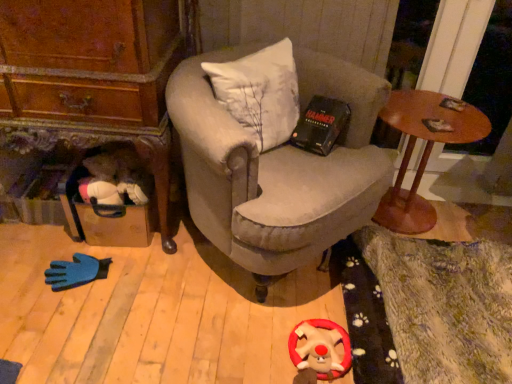
The width and height of the screenshot is (512, 384). In order to click on wooden round table at right in this screenshot , I will do `click(423, 153)`.

Identify the location of velvet gray armchair at center. (278, 166).

From the image's perspective, which one is positioned lower, velvety red plush reindeer at lower center or velvet gray armchair at center?

velvety red plush reindeer at lower center, from the image's perspective.

Which object is positioned more to the left, velvety red plush reindeer at lower center or velvet gray armchair at center?

From the viewer's perspective, velvet gray armchair at center appears more on the left side.

Can you confirm if velvety red plush reindeer at lower center is thinner than velvet gray armchair at center?

Correct, the width of velvety red plush reindeer at lower center is less than that of velvet gray armchair at center.

How different are the orientations of velvety red plush reindeer at lower center and velvet gray armchair at center in degrees?

The angle between the facing direction of velvety red plush reindeer at lower center and the facing direction of velvet gray armchair at center is 44.2 degrees.

Can you tell me how much wooden round table at right and velvet gray armchair at center differ in facing direction?

wooden round table at right and velvet gray armchair at center are facing 39.5 degrees away from each other.

Considering the relative positions of wooden round table at right and velvet gray armchair at center in the image provided, is wooden round table at right to the left or to the right of velvet gray armchair at center?

In the image, wooden round table at right appears on the right side of velvet gray armchair at center.

Is wooden round table at right far away from velvet gray armchair at center?

No, wooden round table at right is not far away from velvet gray armchair at center.

Find the location of a particular element. The width and height of the screenshot is (512, 384). desk lying above the velvet gray armchair at center (from the image's perspective) is located at coordinates (423, 153).

At what (x,y) coordinates should I click in order to perform the action: click on desk behind the velvety red plush reindeer at lower center. Please return your answer as a coordinate pair (x, y). Looking at the image, I should click on (423, 153).

Would you say wooden round table at right is outside velvety red plush reindeer at lower center?

wooden round table at right lies outside velvety red plush reindeer at lower center's area.

From the picture: Does wooden round table at right have a lesser height compared to velvety red plush reindeer at lower center?

No, wooden round table at right is not shorter than velvety red plush reindeer at lower center.

Visually, is velvet gray armchair at center positioned to the left or to the right of velvety red plush reindeer at lower center?

Based on their positions, velvet gray armchair at center is located to the left of velvety red plush reindeer at lower center.

From a real-world perspective, is velvet gray armchair at center on velvety red plush reindeer at lower center?

Yes.

Does velvet gray armchair at center contain wooden round table at right?

That's incorrect, wooden round table at right is not inside velvet gray armchair at center.

Between velvet gray armchair at center and wooden round table at right, which one appears on the left side from the viewer's perspective?

velvet gray armchair at center.

Considering the relative sizes of velvet gray armchair at center and wooden round table at right in the image provided, is velvet gray armchair at center thinner than wooden round table at right?

No, velvet gray armchair at center is not thinner than wooden round table at right.

Are velvet gray armchair at center and wooden round table at right far apart?

No.

Is the depth of velvety red plush reindeer at lower center greater than that of wooden round table at right?

No, velvety red plush reindeer at lower center is closer to the camera.

Measure the distance between velvety red plush reindeer at lower center and wooden round table at right.

A distance of 31.85 inches exists between velvety red plush reindeer at lower center and wooden round table at right.

Is point (319, 321) closer to viewer compared to point (445, 108)?

Yes, it is in front of point (445, 108).

Which of these two, velvety red plush reindeer at lower center or wooden round table at right, is wider?

With larger width is wooden round table at right.

Locate an element on the screen. The image size is (512, 384). chair that appears above the velvety red plush reindeer at lower center (from the image's perspective) is located at coordinates (278, 166).

Locate an element on the screen. The width and height of the screenshot is (512, 384). chair above the wooden round table at right (from a real-world perspective) is located at coordinates click(x=278, y=166).

From the image, which object appears to be nearer to velvet gray armchair at center, wooden round table at right or velvety red plush reindeer at lower center?

wooden round table at right is closer to velvet gray armchair at center.

Based on their spatial positions, is velvety red plush reindeer at lower center or velvet gray armchair at center closer to wooden round table at right?

velvet gray armchair at center is positioned closer to the anchor wooden round table at right.

Based on the photo, estimate the real-world distances between objects in this image. Which object is further from velvety red plush reindeer at lower center, velvet gray armchair at center or wooden round table at right?

Based on the image, wooden round table at right appears to be further to velvety red plush reindeer at lower center.

When comparing their distances from velvet gray armchair at center, does velvety red plush reindeer at lower center or wooden round table at right seem closer?

wooden round table at right.

Which object lies nearer to the anchor point wooden round table at right, velvet gray armchair at center or velvety red plush reindeer at lower center?

velvet gray armchair at center is closer to wooden round table at right.

Considering their positions, is wooden round table at right positioned further to velvety red plush reindeer at lower center than velvet gray armchair at center?

wooden round table at right is further to velvety red plush reindeer at lower center.

Where is `chair between wooden round table at right and velvety red plush reindeer at lower center vertically`? Image resolution: width=512 pixels, height=384 pixels. chair between wooden round table at right and velvety red plush reindeer at lower center vertically is located at coordinates (278, 166).